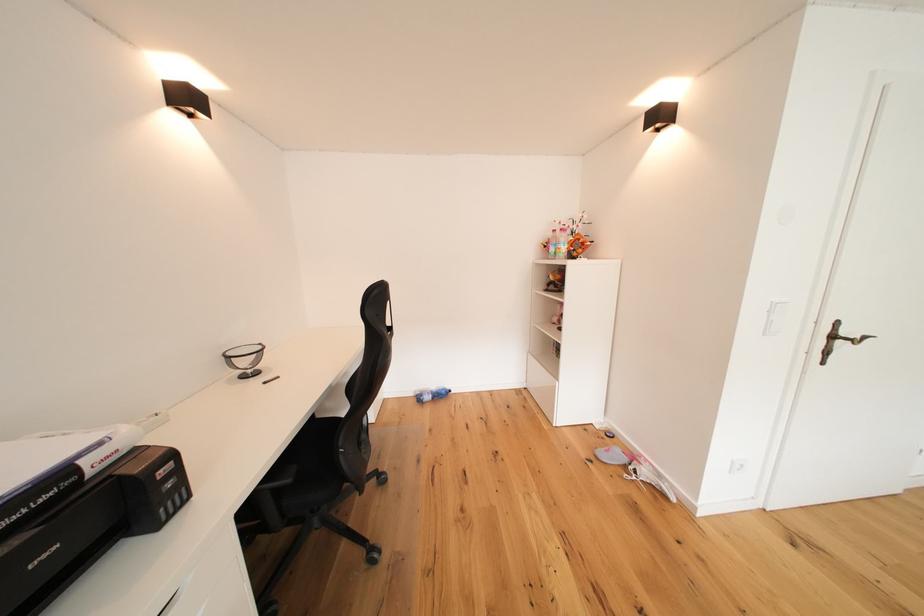
Where would you lift the pink-labeled bottle? Please return your answer as a coordinate pair (x, y).

(553, 244)